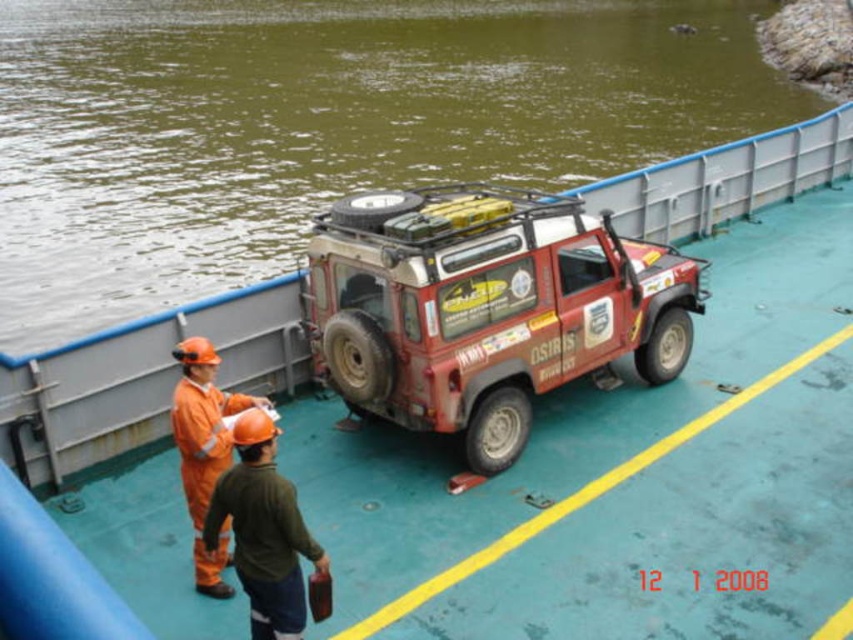
Can you confirm if green water at upper left is smaller than orange hard hat at left?

Incorrect, green water at upper left is not smaller in size than orange hard hat at left.

Who is higher up, green water at upper left or orange hard hat at left?

green water at upper left is above.

Find the location of a particular element. The width and height of the screenshot is (853, 640). green water at upper left is located at coordinates (321, 124).

Does point (492, 378) come farther from viewer compared to point (230, 592)?

That is True.

Does rusty metal jeep at center have a greater width compared to orange hard hat at left?

Correct, the width of rusty metal jeep at center exceeds that of orange hard hat at left.

Which is behind, point (410, 410) or point (206, 422)?

Positioned behind is point (410, 410).

Identify the location of rusty metal jeep at center. (485, 307).

Measure the distance from rusty metal jeep at center to orange hard hat at center.

The distance of rusty metal jeep at center from orange hard hat at center is 3.09 meters.

Is rusty metal jeep at center bigger than orange hard hat at center?

Indeed, rusty metal jeep at center has a larger size compared to orange hard hat at center.

Image resolution: width=853 pixels, height=640 pixels. What do you see at coordinates (485, 307) in the screenshot? I see `rusty metal jeep at center` at bounding box center [485, 307].

The image size is (853, 640). I want to click on rusty metal jeep at center, so click(485, 307).